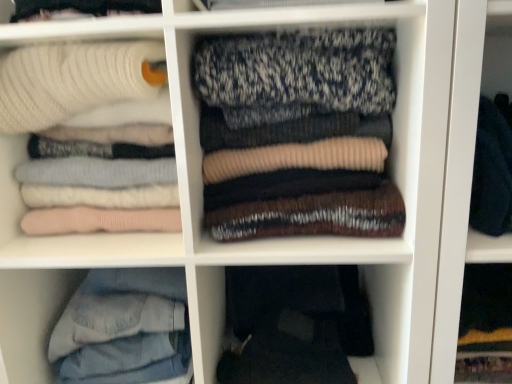
Question: Is the depth of denim jeans at lower left greater than that of dark gray fabric pants at lower center?

Choices:
 (A) no
 (B) yes

Answer: (A)

Question: Can you confirm if denim jeans at lower left is smaller than dark gray fabric pants at lower center?

Choices:
 (A) yes
 (B) no

Answer: (B)

Question: Can you confirm if denim jeans at lower left is taller than dark gray fabric pants at lower center?

Choices:
 (A) yes
 (B) no

Answer: (A)

Question: Considering the relative sizes of denim jeans at lower left and dark gray fabric pants at lower center in the image provided, is denim jeans at lower left thinner than dark gray fabric pants at lower center?

Choices:
 (A) yes
 (B) no

Answer: (A)

Question: From a real-world perspective, is denim jeans at lower left on dark gray fabric pants at lower center?

Choices:
 (A) yes
 (B) no

Answer: (A)

Question: From the image's perspective, is denim jeans at lower left located above dark gray fabric pants at lower center?

Choices:
 (A) no
 (B) yes

Answer: (B)

Question: From a real-world perspective, is knit sweater at center, the first laundry from the right, positioned under white ribbed sweater at upper left, placed as the 1th laundry when sorted from left to right, based on gravity?

Choices:
 (A) no
 (B) yes

Answer: (A)

Question: From the image's perspective, is knit sweater at center, which is the second laundry from left to right, located beneath white ribbed sweater at upper left, placed as the 1th laundry when sorted from left to right?

Choices:
 (A) yes
 (B) no

Answer: (B)

Question: Can you confirm if knit sweater at center, which is the second laundry from left to right, is taller than white ribbed sweater at upper left, the 2th laundry in the right-to-left sequence?

Choices:
 (A) yes
 (B) no

Answer: (B)

Question: Is knit sweater at center, which is the second laundry from left to right, positioned before white ribbed sweater at upper left, the 2th laundry in the right-to-left sequence?

Choices:
 (A) no
 (B) yes

Answer: (B)

Question: Is knit sweater at center, the first laundry from the right, with white ribbed sweater at upper left, the 2th laundry in the right-to-left sequence?

Choices:
 (A) yes
 (B) no

Answer: (B)

Question: From the image's perspective, is knit sweater at center, which is the second laundry from left to right, above white ribbed sweater at upper left, the 2th laundry in the right-to-left sequence?

Choices:
 (A) yes
 (B) no

Answer: (A)

Question: Is knit sweater at center, the first laundry from the right, far away from denim jeans at lower left?

Choices:
 (A) no
 (B) yes

Answer: (A)